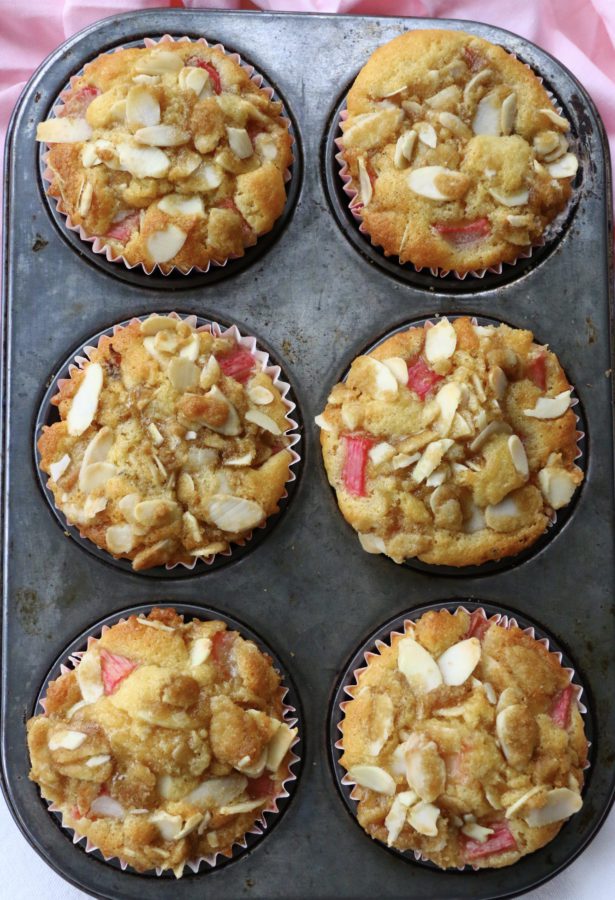
Where is `paper liner`? The image size is (615, 900). paper liner is located at coordinates (261, 824).